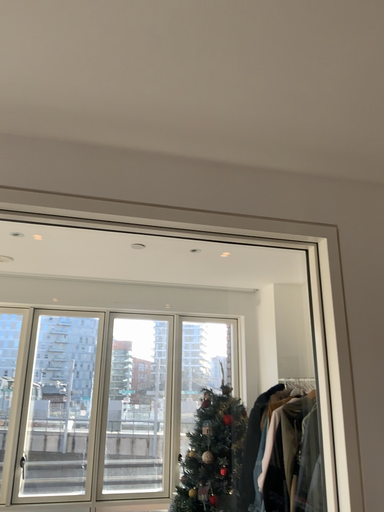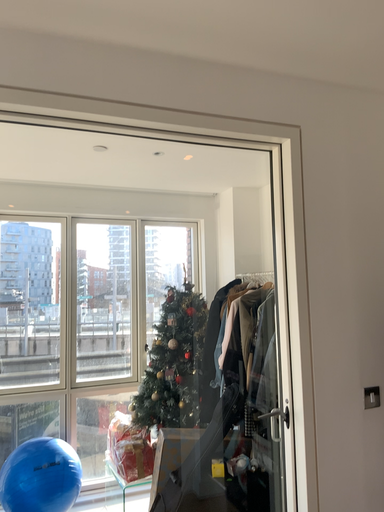
Question: Which way did the camera rotate in the video?

Choices:
 (A) rotated upward
 (B) rotated downward

Answer: (B)